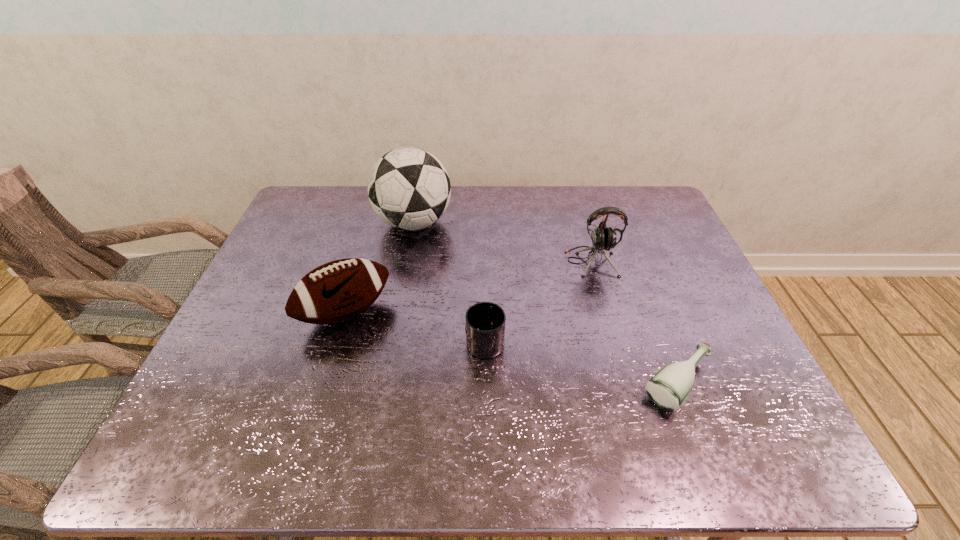
I want to click on free space that satisfies the following two spatial constraints: 1. with the handle on the side of the third object from left to right; 2. on the surface of the tallest object where the brand logo is visible, so click(484, 223).

Identify the location of vacant space that satisfies the following two spatial constraints: 1. on the back side of the second tallest object; 2. on the surface of the soccer ball where the brand logo is visible. Image resolution: width=960 pixels, height=540 pixels. (581, 223).

The width and height of the screenshot is (960, 540). What are the coordinates of `free space that satisfies the following two spatial constraints: 1. on the back side of the earphone; 2. on the left side of the third shortest object` in the screenshot? It's located at (361, 261).

What are the coordinates of `free space that satisfies the following two spatial constraints: 1. on the surface of the soccer ball where the brand logo is visible; 2. on the right side of the earphone` in the screenshot? It's located at (407, 261).

Identify the location of blank space that satisfies the following two spatial constraints: 1. on the surface of the tallest object where the brand logo is visible; 2. on the right side of the second tallest object. The image size is (960, 540). (407, 261).

In order to click on blank space that satisfies the following two spatial constraints: 1. with the handle on the side of the earphone; 2. on the right side of the mug in this screenshot , I will do `click(484, 261)`.

This screenshot has height=540, width=960. What are the coordinates of `vacant position in the image that satisfies the following two spatial constraints: 1. on the surface of the earphone where the brand logo is visible; 2. on the right side of the soccer ball` in the screenshot? It's located at tap(407, 261).

You are a GUI agent. You are given a task and a screenshot of the screen. Output one action in this format:
    pyautogui.click(x=<x>, y=<y>)
    Task: Click on the vacant space that satisfies the following two spatial constraints: 1. with the handle on the side of the third object from left to right; 2. on the left side of the second tallest object
    The width and height of the screenshot is (960, 540).
    Given the screenshot: What is the action you would take?
    pyautogui.click(x=484, y=261)